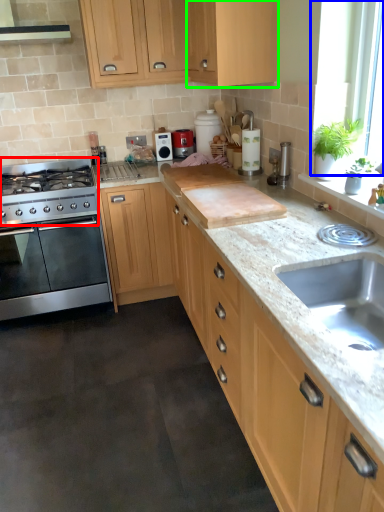
Question: Based on their relative distances, which object is nearer to gas stove (highlighted by a red box)? Choose from window screen (highlighted by a blue box) and cabinetry (highlighted by a green box).

Choices:
 (A) window screen
 (B) cabinetry

Answer: (B)